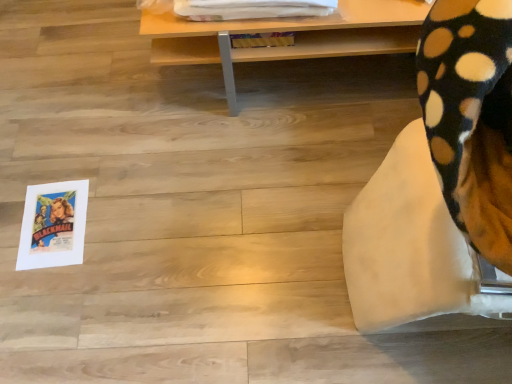
Identify the location of vacant space that is in between wooden table at upper center and soft fleece blanket at lower right. (294, 172).